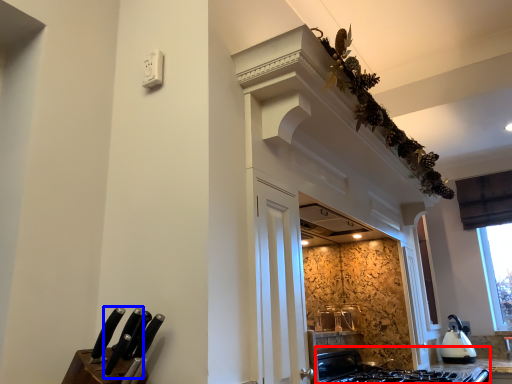
Question: Which point is further to the camera, gas stove (highlighted by a red box) or knife (highlighted by a blue box)?

Choices:
 (A) gas stove
 (B) knife

Answer: (A)